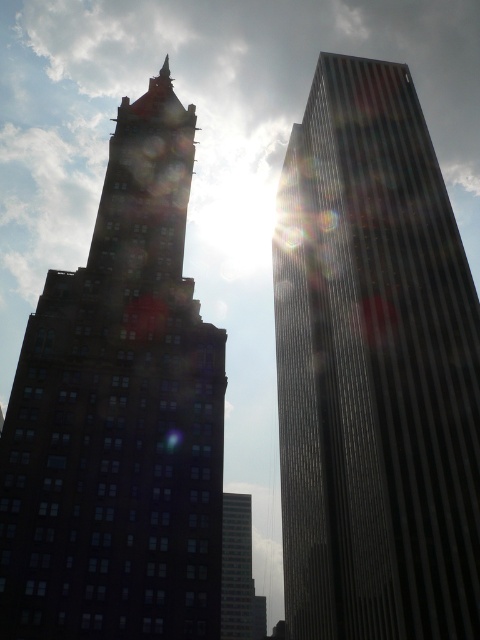
Does reflective glass skyscraper at right have a smaller size compared to smooth glass skyscraper at center?

Incorrect, reflective glass skyscraper at right is not smaller in size than smooth glass skyscraper at center.

Is reflective glass skyscraper at right positioned at the back of smooth glass skyscraper at center?

No, it is in front of smooth glass skyscraper at center.

Which is in front, point (392, 452) or point (261, 608)?

Point (392, 452) is more forward.

Identify the location of reflective glass skyscraper at right. The image size is (480, 640). (373, 369).

In the scene shown: Which of these two, reflective glass skyscraper at right or matte glass building at left, stands shorter?

With less height is matte glass building at left.

Does reflective glass skyscraper at right have a greater width compared to matte glass building at left?

Yes.

Between point (393, 492) and point (183, 618), which one is positioned behind?

Positioned behind is point (393, 492).

This screenshot has width=480, height=640. In order to click on reflective glass skyscraper at right in this screenshot , I will do `click(373, 369)`.

Is matte glass building at left closer to camera compared to smooth glass skyscraper at center?

Yes, it is in front of smooth glass skyscraper at center.

Can you confirm if matte glass building at left is positioned to the left of smooth glass skyscraper at center?

Yes, matte glass building at left is to the left of smooth glass skyscraper at center.

Which is in front, point (135, 164) or point (245, 499)?

Point (135, 164)

Where is `matte glass building at left`? This screenshot has width=480, height=640. matte glass building at left is located at coordinates (119, 417).